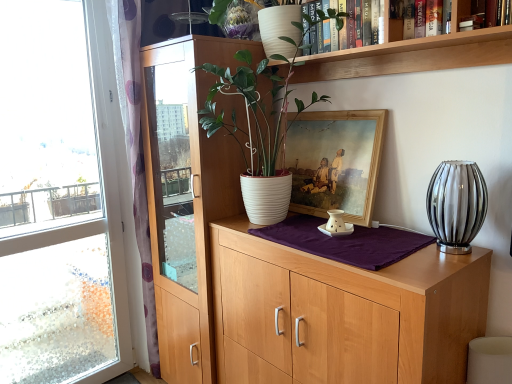
Locate an element on the screen. free point above light wood cabinet at center (from a real-world perspective) is located at coordinates (354, 237).